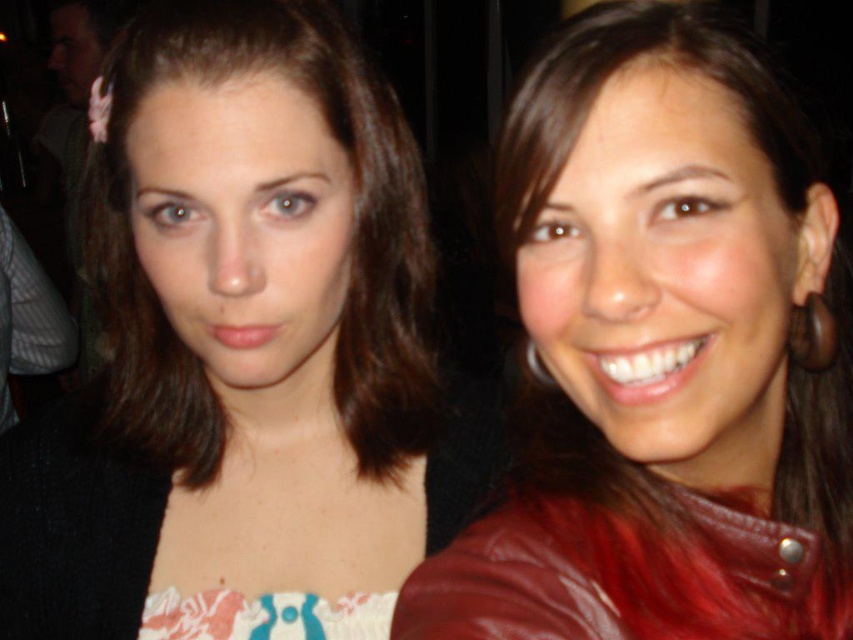
You are a photographer trying to capture a group photo of the two people in the scene. You need to ensure there is enough space between them to fit a third person standing between them. The third person requires at least 10 inches of space. Based on the current positioning, can the third person fit between matte black hair at center and red leather jacket at right?

The distance between matte black hair at center and red leather jacket at right is 8.28 inches. Since the required space is 10 inches, the third person cannot fit between them as the current distance is insufficient.

You are a photographer at a social event. You want to take a photo of two people standing close together. The person on the left is wearing a black cardigan over a patterned top with white, red, and blue tones, and the person on the right is wearing a red leather jacket. The two people are standing at coordinates point [166,353]. If your camera has a maximum focus range of 25 inches, will you be able to capture both people clearly in focus?

The two people are 26.46 inches apart, which exceeds the camera maximum focus range of 25 inches. Therefore, you will not be able to capture both people clearly in focus.

You are a photographer at the event and need to ensure both the matte black hair at center and the red leather jacket at right are fully visible in the photo. Given the height difference, which object should you adjust your camera angle to focus on to include both?

The matte black hair at center is much taller than the red leather jacket at right, so you should lower your camera angle slightly to capture the full height of the taller object while still including the shorter one in the frame.